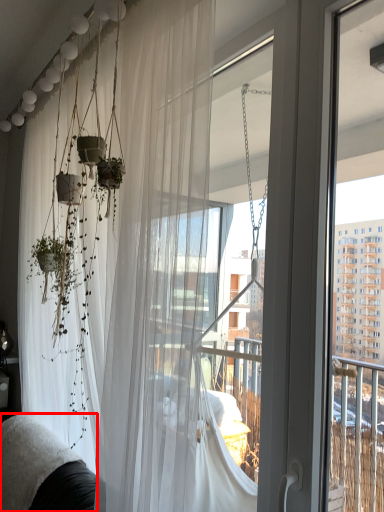
Question: From the image's perspective, what is the correct spatial positioning of couch (annotated by the red box) in reference to curtain?

Choices:
 (A) above
 (B) below

Answer: (B)